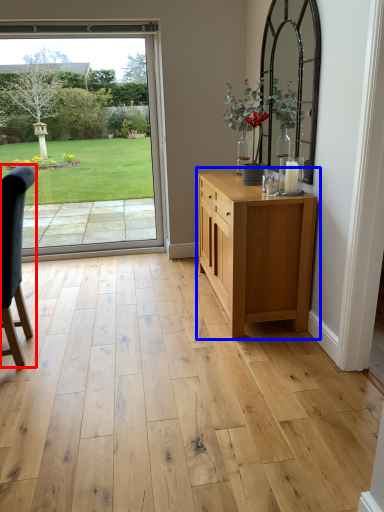
Question: Which of the following is the farthest to the observer, chair (highlighted by a red box) or chest of drawers (highlighted by a blue box)?

Choices:
 (A) chair
 (B) chest of drawers

Answer: (B)